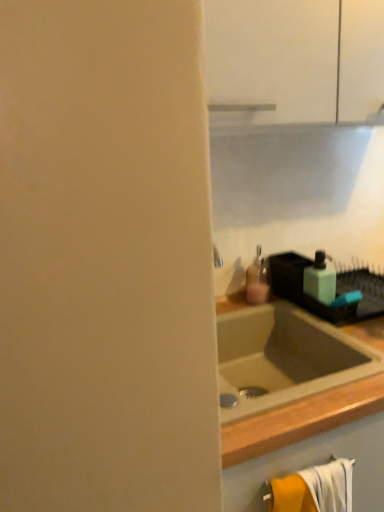
Question: Does matte pink plastic soap dispenser at center, placed as the 1th soap dispenser when sorted from left to right, have a greater height compared to green matte soap dispenser at right, which is the 1th soap dispenser from right to left?

Choices:
 (A) yes
 (B) no

Answer: (A)

Question: Considering the relative sizes of matte pink plastic soap dispenser at center, which is the 2th soap dispenser in right-to-left order, and green matte soap dispenser at right, which is the 2th soap dispenser in left-to-right order, in the image provided, is matte pink plastic soap dispenser at center, which is the 2th soap dispenser in right-to-left order, wider than green matte soap dispenser at right, which is the 2th soap dispenser in left-to-right order,?

Choices:
 (A) no
 (B) yes

Answer: (A)

Question: Could you tell me if matte pink plastic soap dispenser at center, placed as the 1th soap dispenser when sorted from left to right, is turned towards green matte soap dispenser at right, which is the 2th soap dispenser in left-to-right order?

Choices:
 (A) no
 (B) yes

Answer: (A)

Question: Does matte pink plastic soap dispenser at center, placed as the 1th soap dispenser when sorted from left to right, come in front of green matte soap dispenser at right, which is the 2th soap dispenser in left-to-right order?

Choices:
 (A) yes
 (B) no

Answer: (B)

Question: Can green matte soap dispenser at right, which is the 1th soap dispenser from right to left, be found inside matte pink plastic soap dispenser at center, which is the 2th soap dispenser in right-to-left order?

Choices:
 (A) no
 (B) yes

Answer: (A)

Question: Is point (322, 274) positioned closer to the camera than point (336, 481)?

Choices:
 (A) closer
 (B) farther

Answer: (B)

Question: Looking at their shapes, would you say green matte soap dispenser at right, which is the 2th soap dispenser in left-to-right order, is wider or thinner than orange cotton bath towel at lower right?

Choices:
 (A) thin
 (B) wide

Answer: (B)

Question: Which is correct: green matte soap dispenser at right, which is the 1th soap dispenser from right to left, is inside orange cotton bath towel at lower right, or outside of it?

Choices:
 (A) inside
 (B) outside

Answer: (B)

Question: From a real-world perspective, is green matte soap dispenser at right, which is the 2th soap dispenser in left-to-right order, positioned above or below orange cotton bath towel at lower right?

Choices:
 (A) below
 (B) above

Answer: (B)

Question: Do you think matte pink plastic soap dispenser at center, placed as the 1th soap dispenser when sorted from left to right, is within green matte soap dispenser at right, which is the 2th soap dispenser in left-to-right order, or outside of it?

Choices:
 (A) outside
 (B) inside

Answer: (A)

Question: From the image's perspective, is matte pink plastic soap dispenser at center, which is the 2th soap dispenser in right-to-left order, above or below green matte soap dispenser at right, which is the 2th soap dispenser in left-to-right order?

Choices:
 (A) below
 (B) above

Answer: (B)

Question: Is matte pink plastic soap dispenser at center, which is the 2th soap dispenser in right-to-left order, wider or thinner than green matte soap dispenser at right, which is the 2th soap dispenser in left-to-right order?

Choices:
 (A) thin
 (B) wide

Answer: (A)

Question: From a real-world perspective, is matte pink plastic soap dispenser at center, which is the 2th soap dispenser in right-to-left order, above or below green matte soap dispenser at right, which is the 2th soap dispenser in left-to-right order?

Choices:
 (A) below
 (B) above

Answer: (A)

Question: From the image's perspective, is orange cotton bath towel at lower right positioned above or below matte pink plastic soap dispenser at center, which is the 2th soap dispenser in right-to-left order?

Choices:
 (A) below
 (B) above

Answer: (A)

Question: From a real-world perspective, is orange cotton bath towel at lower right positioned above or below matte pink plastic soap dispenser at center, which is the 2th soap dispenser in right-to-left order?

Choices:
 (A) below
 (B) above

Answer: (A)